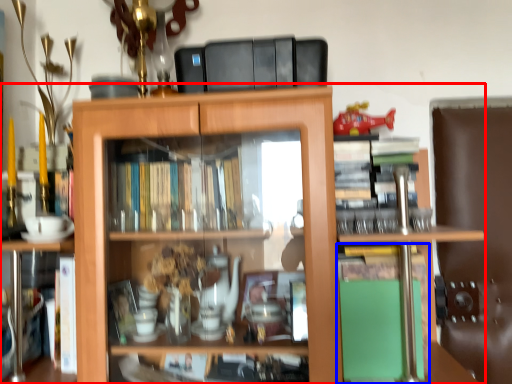
Question: Which of the following is the farthest to the observer, shelf (highlighted by a red box) or book (highlighted by a blue box)?

Choices:
 (A) shelf
 (B) book

Answer: (B)